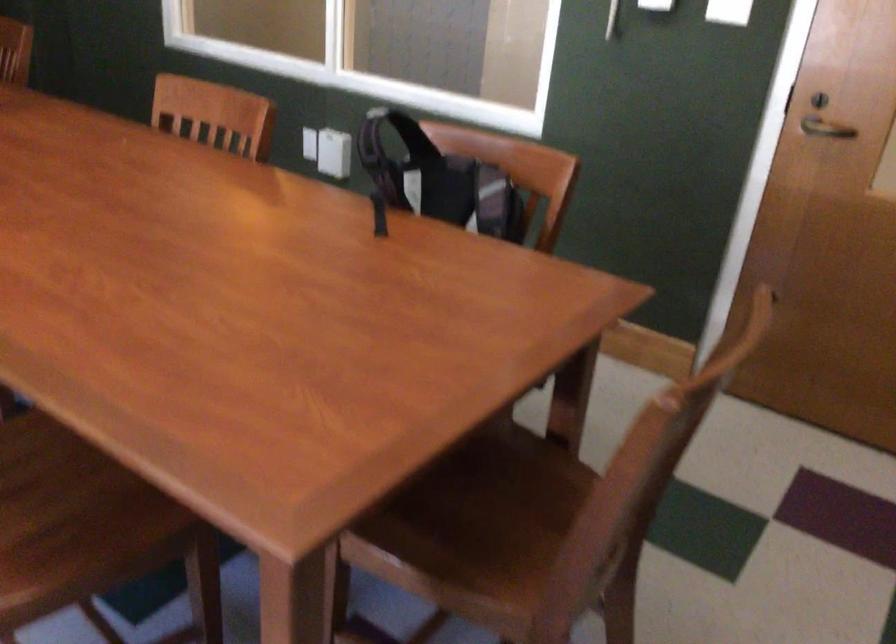
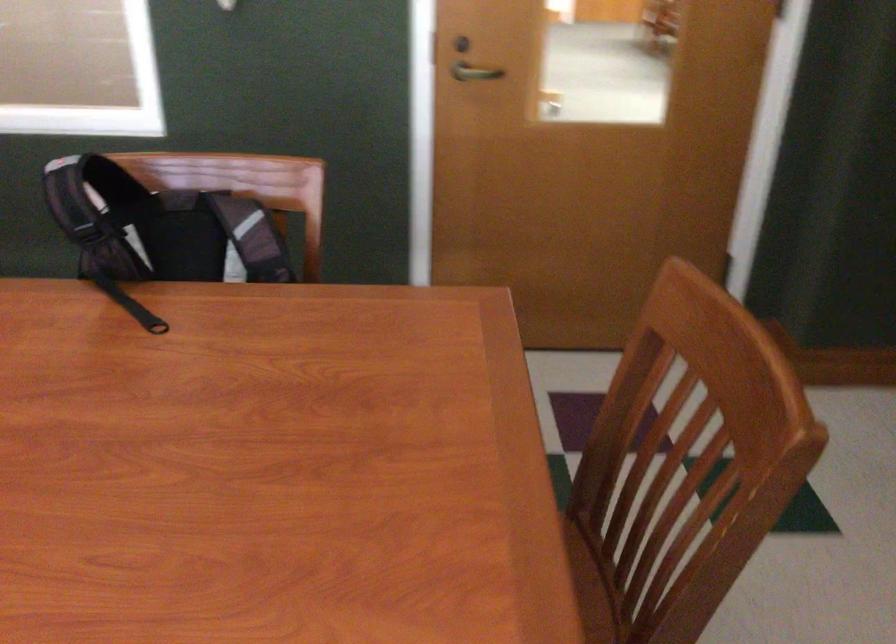
Where in the second image is the point corresponding to [820,96] from the first image?

(460, 44)